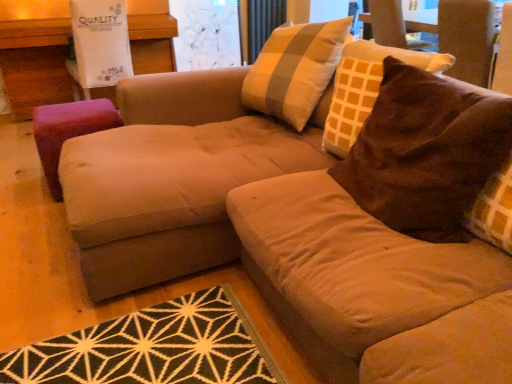
Question: From the image's perspective, relative to transparent glass screen door at upper center, is orange fabric curtain at upper center above or below?

Choices:
 (A) above
 (B) below

Answer: (A)

Question: From a real-world perspective, is orange fabric curtain at upper center above or below transparent glass screen door at upper center?

Choices:
 (A) below
 (B) above

Answer: (A)

Question: Estimate the real-world distances between objects in this image. Which object is farther from the transparent glass screen door at upper center?

Choices:
 (A) purple fabric ottoman at left
 (B) brown suede swivel chair at upper right
 (C) purple fabric stool at left
 (D) orange fabric curtain at upper center
 (E) brown suede pillow at upper right

Answer: (E)

Question: Which object is positioned farthest from the brown suede swivel chair at upper right?

Choices:
 (A) brown suede pillow at upper right
 (B) orange fabric curtain at upper center
 (C) purple fabric stool at left
 (D) purple fabric ottoman at left
 (E) transparent glass screen door at upper center

Answer: (D)